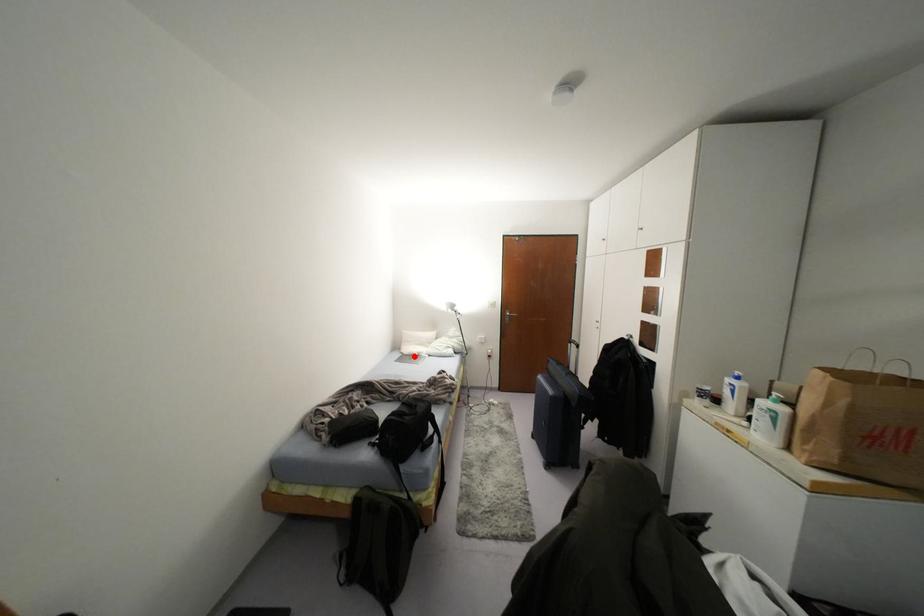
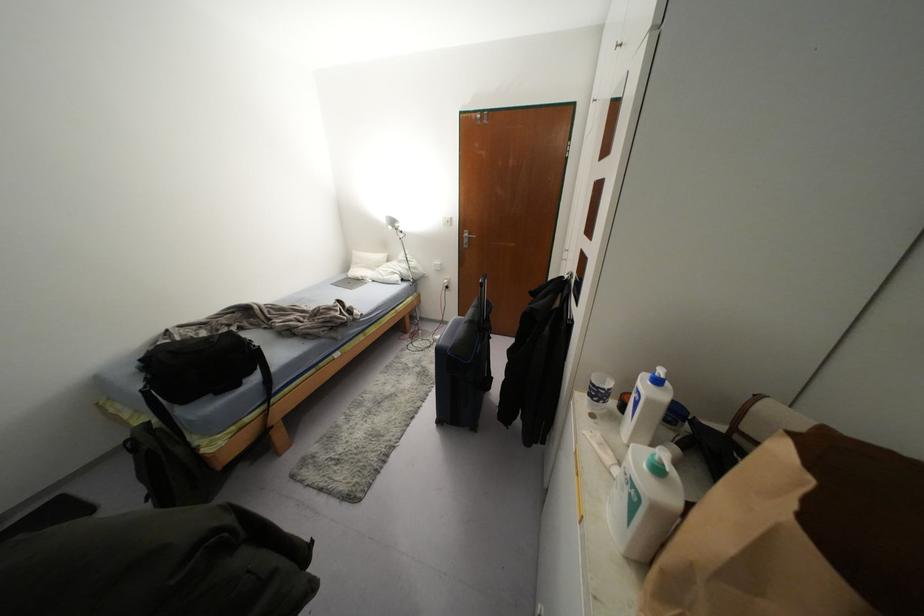
Question: I am providing you with two images of the same scene from different viewpoints. Given a red point in image1, look at the same physical point in image2. Is it:

Choices:
 (A) Closer to the viewpoint
 (B) Farther from the viewpoint

Answer: (A)